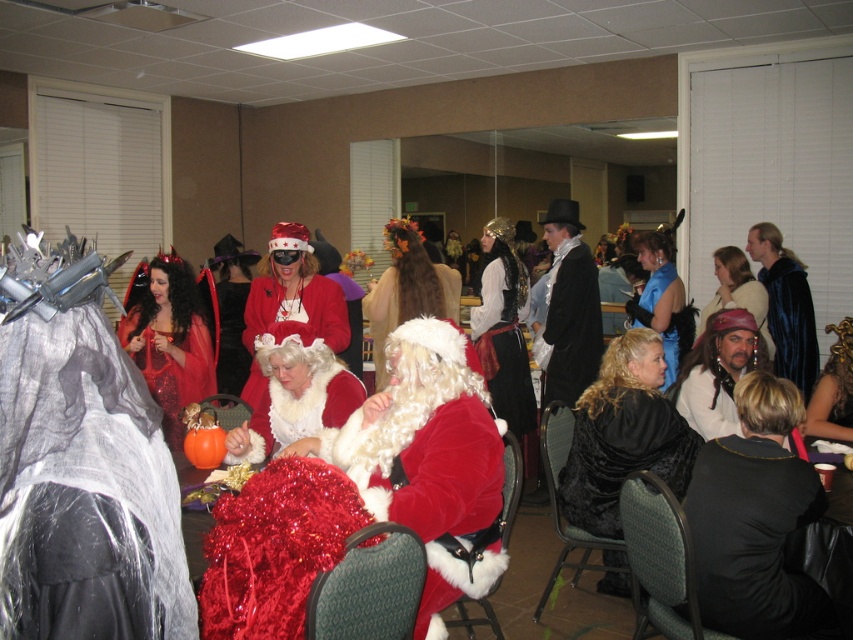
Question: Is fuzzy red santa at center in front of velvet black coat at center?

Choices:
 (A) yes
 (B) no

Answer: (A)

Question: Observing the image, what is the correct spatial positioning of shiny black vest at lower right in reference to leather vest at center?

Choices:
 (A) right
 (B) left

Answer: (B)

Question: Which point is farther from the camera taking this photo?

Choices:
 (A) (317, 288)
 (B) (704, 374)
 (C) (573, 380)
 (D) (822, 502)

Answer: (C)

Question: Which object is positioned closest to the shiny red fabric dress at center?

Choices:
 (A) velvet blue dress at center
 (B) velvet black coat at center

Answer: (B)

Question: Based on their relative distances, which object is nearer to the velvet blue cape at right?

Choices:
 (A) leather vest at center
 (B) black velvet coat at center
 (C) white fluffy wig at center
 (D) velvet santa claus at center

Answer: (A)

Question: Is fuzzy red santa at center wider than velvet santa claus at center?

Choices:
 (A) no
 (B) yes

Answer: (A)